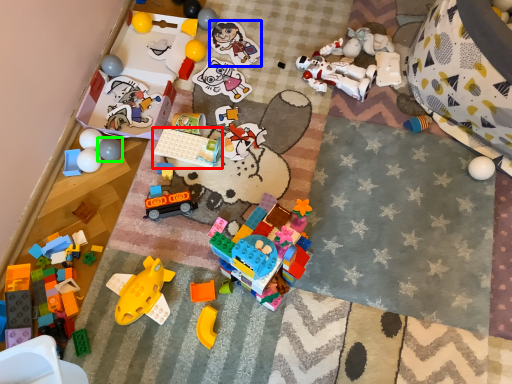
Question: Which is farther away from toy (highlighted by a red box)? toy (highlighted by a blue box) or toy (highlighted by a green box)?

Choices:
 (A) toy
 (B) toy

Answer: (A)